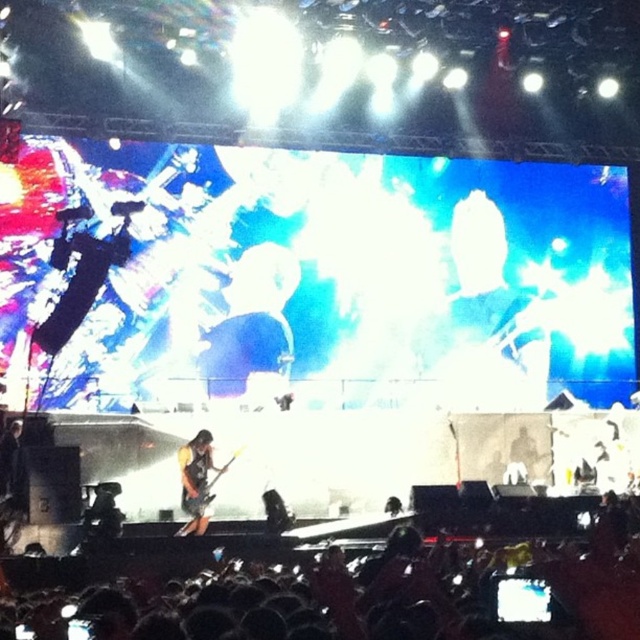
You are a photographer trying to capture the stage from the front row. You notice the black fabric crowd at lower center and the orange fabric guitar at center. Which object is nearer to your camera lens?

The black fabric crowd at lower center is closer to the viewer than the orange fabric guitar at center, so the black fabric crowd at lower center is nearer to your camera lens.